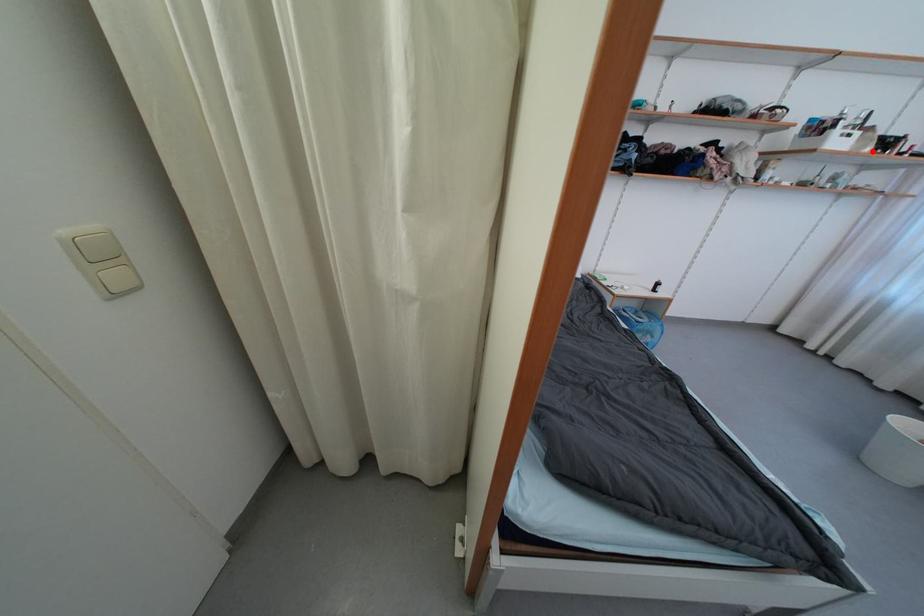
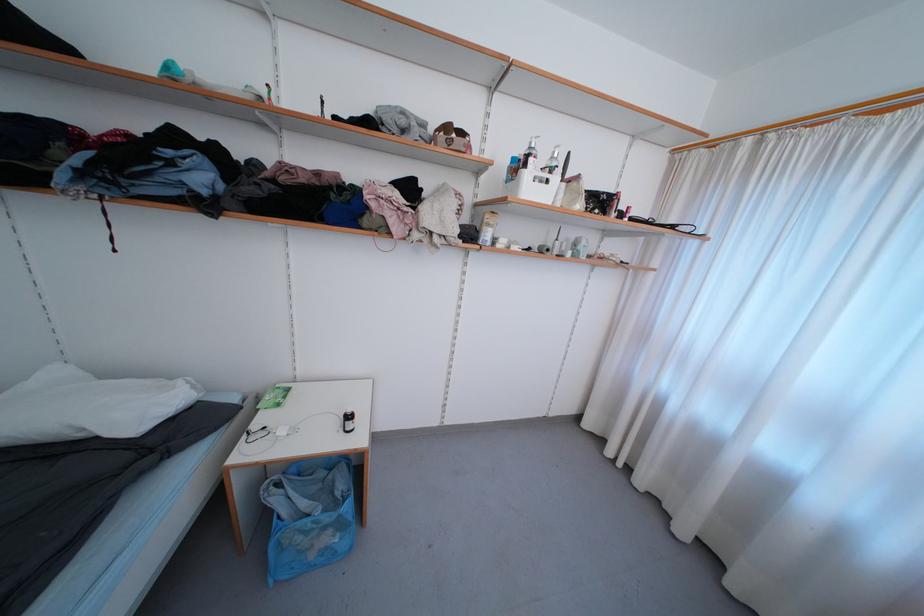
Locate, in the second image, the point that corresponds to the highlighted location in the first image.

(584, 208)